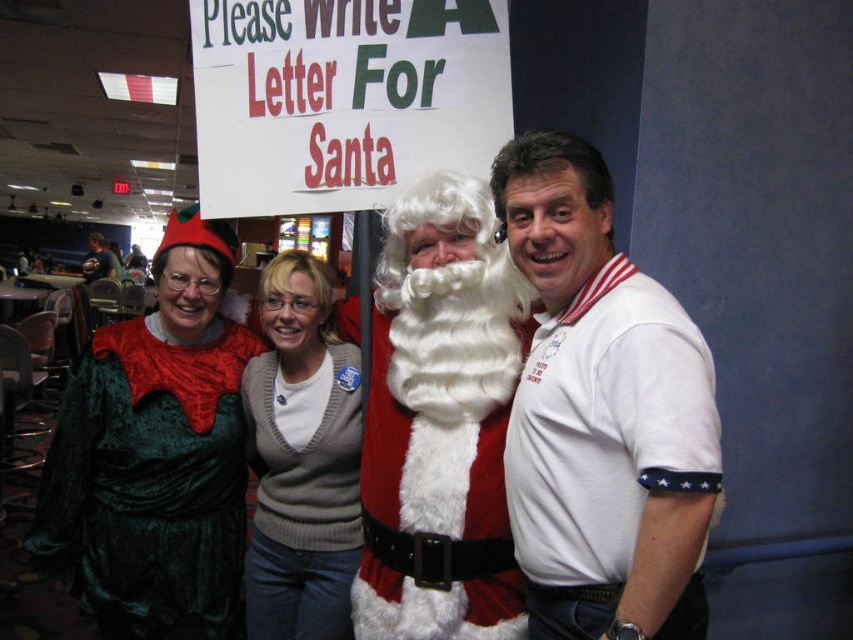
You are trying to decide which outfit to wear for a party. You see the white polo shirt at right and the velvet green dress at left in the image. Which one is positioned higher up?

The white polo shirt at right is located above the velvet green dress at left.

You are trying to identify the person wearing the white fluffy beard at center. Which direction should you look relative to the person wearing the white polo shirt at right?

The white fluffy beard at center is on the left side of the white polo shirt at right, so you should look to the left of the person wearing the white polo shirt at right to find the person with the white fluffy beard at center.

In the festive indoor scene at the bowling alley, there are two white items visible. The first is the white polo shirt at right worn by one of the people, and the second is the white fluffy beard at center belonging to Santa. Based on their sizes, which of these two white items takes up more visual space in the image?

The white fluffy beard at center occupies more visual space than the white polo shirt at right.